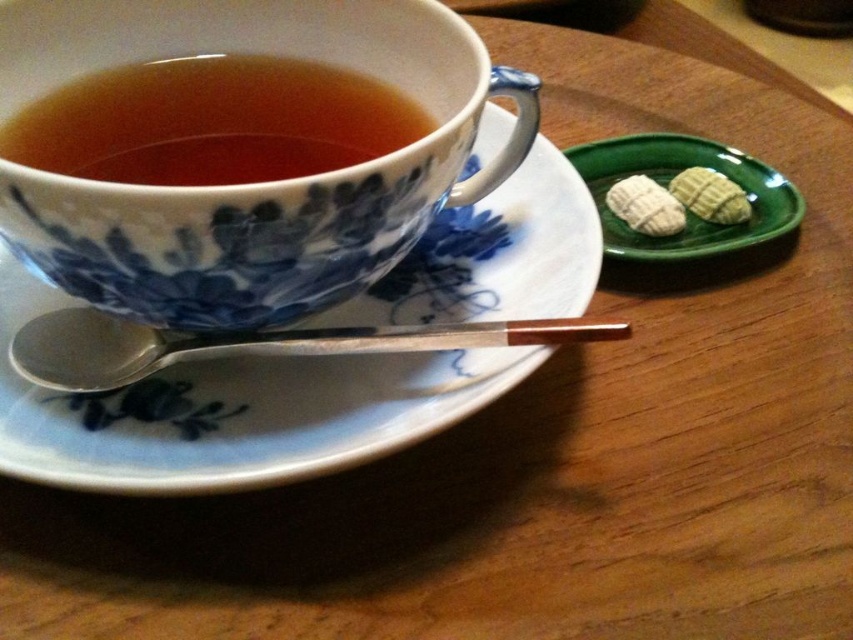
Between point (485, 141) and point (178, 349), which one is positioned behind?

Point (485, 141)

Between white porcelain saucer at upper left and silver metallic spoon at lower left, which one has more height?

white porcelain saucer at upper left is taller.

Does point (552, 296) come closer to viewer compared to point (71, 385)?

No.

Locate an element on the screen. Image resolution: width=853 pixels, height=640 pixels. white porcelain saucer at upper left is located at coordinates (231, 412).

How distant is white textured cookies at upper right from green textured cookie at upper right?

white textured cookies at upper right and green textured cookie at upper right are 1.50 inches apart from each other.

Who is taller, white textured cookies at upper right or green textured cookie at upper right?

white textured cookies at upper right is taller.

Locate an element on the screen. The image size is (853, 640). white textured cookies at upper right is located at coordinates (645, 205).

Measure the distance between white porcelain saucer at upper left and camera.

white porcelain saucer at upper left and camera are 14.94 inches apart.

The image size is (853, 640). Identify the location of white porcelain saucer at upper left. (231, 412).